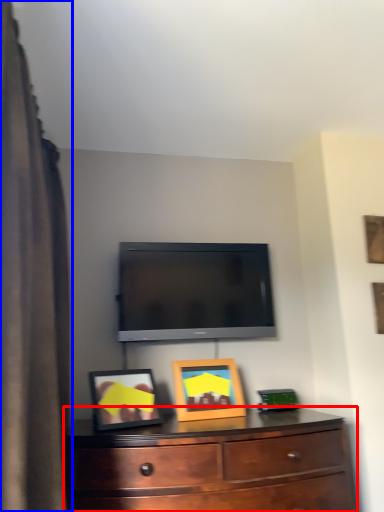
Question: Which of the following is the farthest to the observer, chest of drawers (highlighted by a red box) or curtain (highlighted by a blue box)?

Choices:
 (A) chest of drawers
 (B) curtain

Answer: (A)